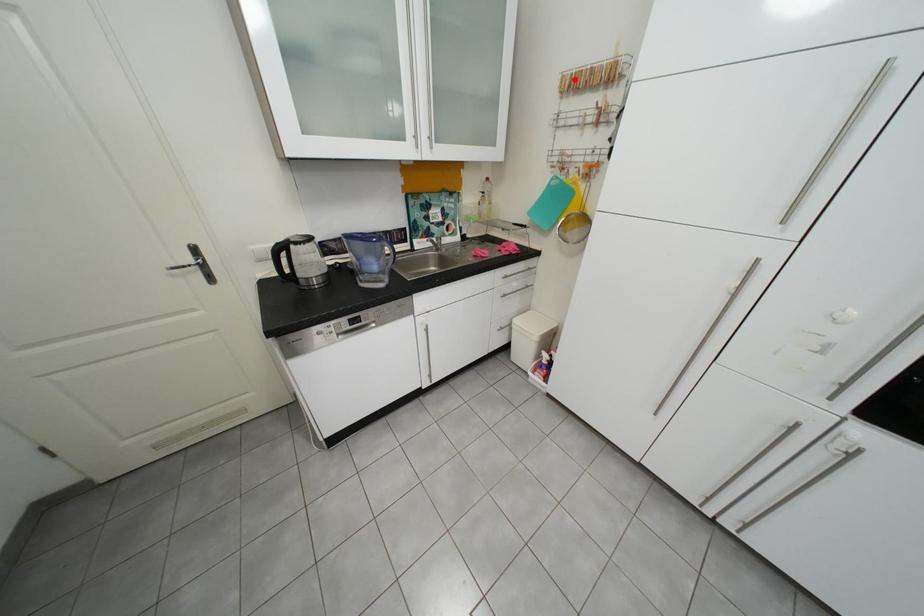
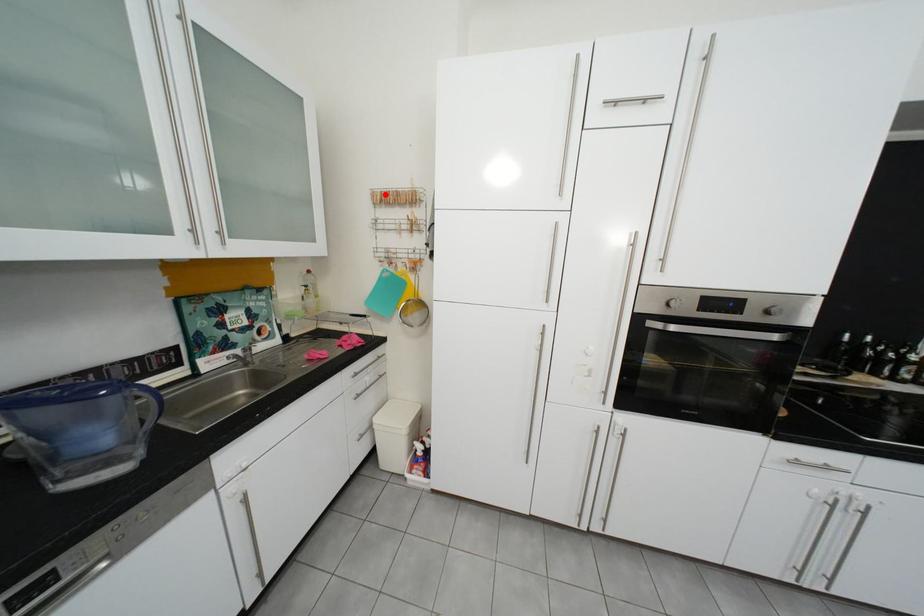
I am providing you with two images of the same scene from different viewpoints. A red point is marked on the first image and another point is marked on the second image. Does the point marked in image1 correspond to the same location as the one in image2?

Yes